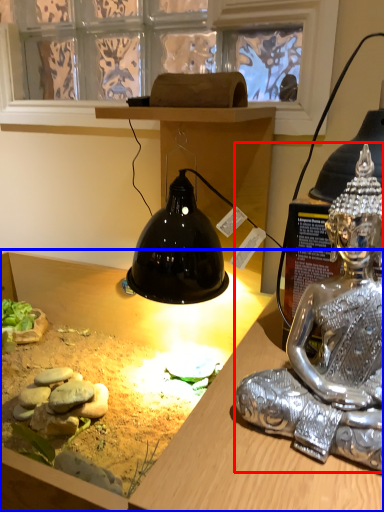
Question: Which object appears farthest to the camera in this image, person (highlighted by a red box) or desk (highlighted by a blue box)?

Choices:
 (A) person
 (B) desk

Answer: (A)